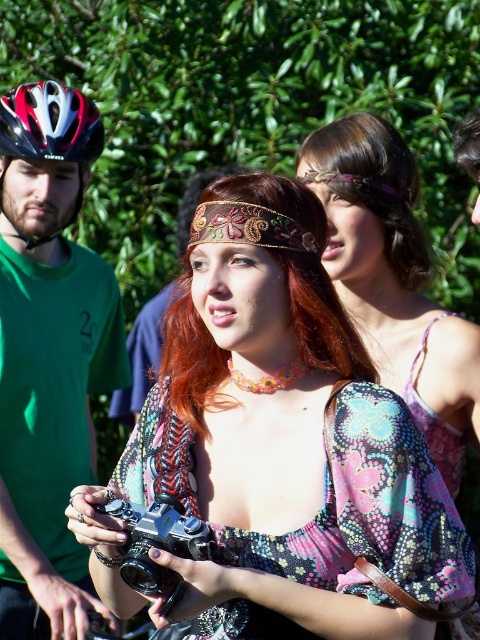
Does point (228, 195) come closer to viewer compared to point (408, 278)?

Yes, point (228, 195) is closer to viewer.

This screenshot has height=640, width=480. Describe the element at coordinates (322, 317) in the screenshot. I see `reddish-brown fabric hair at center` at that location.

Find the location of a particular element. reddish-brown fabric hair at center is located at coordinates (322, 317).

Who is positioned more to the left, reddish-brown fabric hair at center or black plastic camera at center?

black plastic camera at center is more to the left.

Identify the location of reddish-brown fabric hair at center. (322, 317).

Locate an element on the screen. The height and width of the screenshot is (640, 480). reddish-brown fabric hair at center is located at coordinates (322, 317).

Does floral-patterned blouse at center appear on the right side of black plastic camera at center?

Yes, floral-patterned blouse at center is to the right of black plastic camera at center.

Based on the photo, which of these two, floral-patterned blouse at center or black plastic camera at center, stands shorter?

black plastic camera at center

Where is `floral-patterned blouse at center`? This screenshot has width=480, height=640. floral-patterned blouse at center is located at coordinates (278, 445).